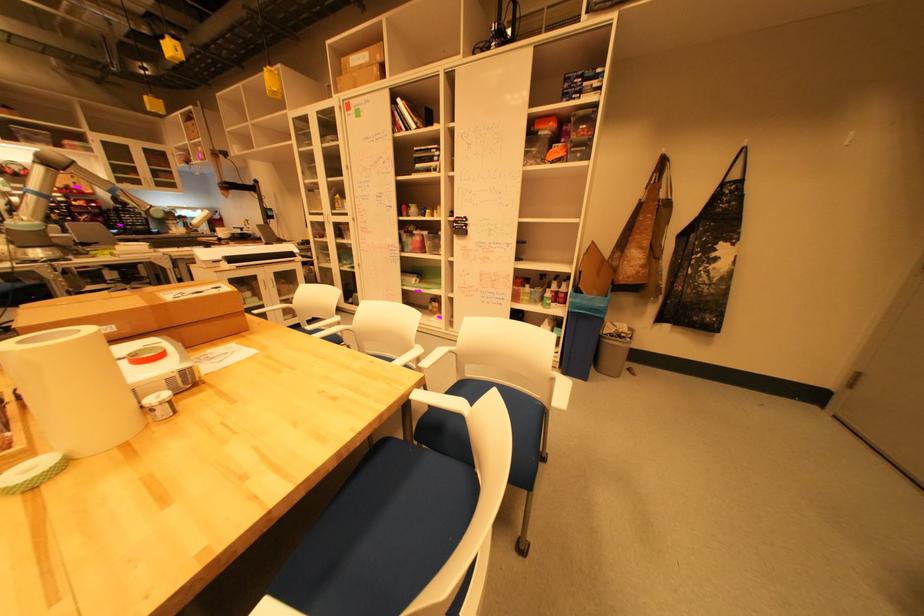
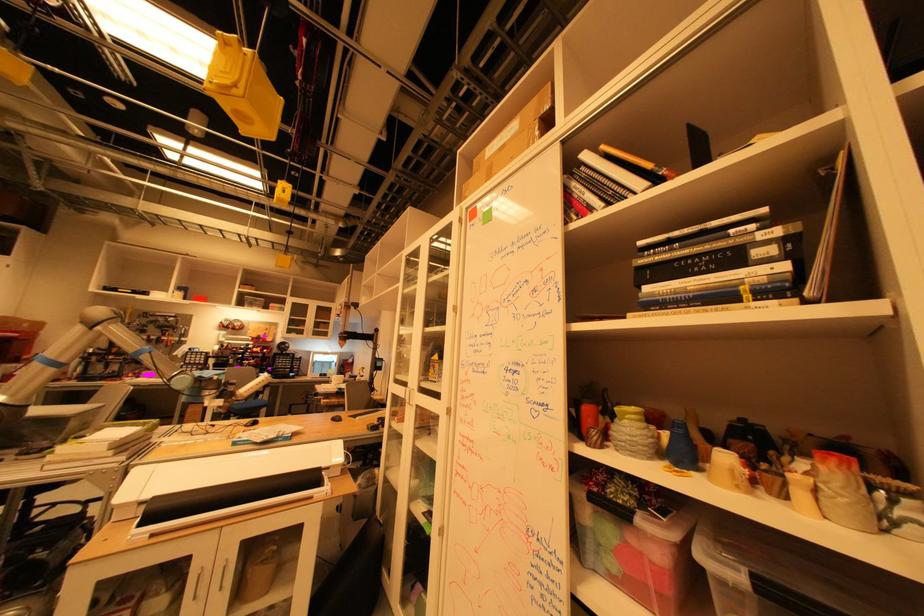
Where in the second image is the point corresponding to point 190,182 from the first image?

(343, 331)